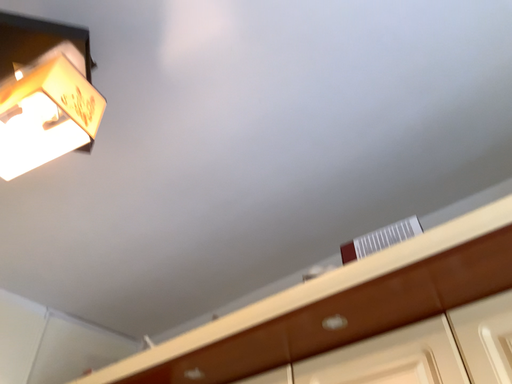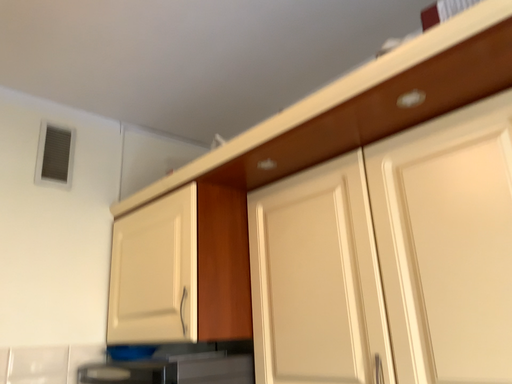
Question: How did the camera likely rotate when shooting the video?

Choices:
 (A) rotated upward
 (B) rotated downward

Answer: (B)